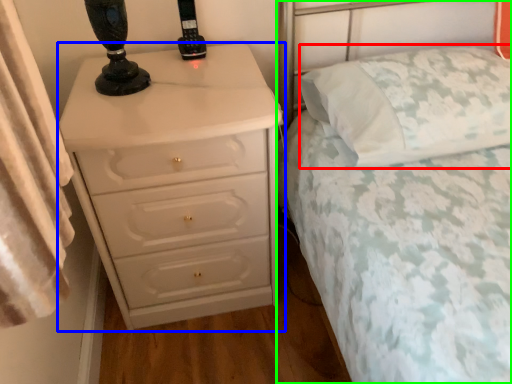
Question: Which object is the farthest from pillow (highlighted by a red box)? Choose among these: chest of drawers (highlighted by a blue box) or bed (highlighted by a green box).

Choices:
 (A) chest of drawers
 (B) bed

Answer: (A)